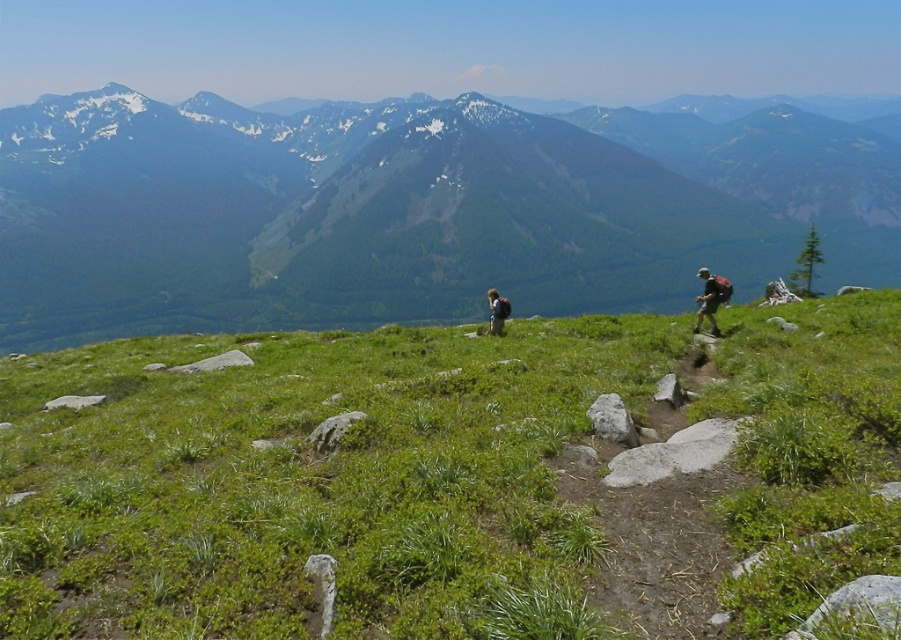
You are a hiker standing on the green grassy at center and want to reach the green grassy hillside at center. Which direction should you move to get there?

The green grassy at center is to the right of green grassy hillside at center, so you should move to the left to reach the green grassy hillside at center.

You are a hiker standing on the green grassy hillside at center and want to place your green fabric backpack at center. Can you safely place it on the ground below you without it rolling away?

The green grassy hillside at center is above the green fabric backpack at center, so placing the backpack on the ground below the hillside may cause it to roll downhill unless secured properly.